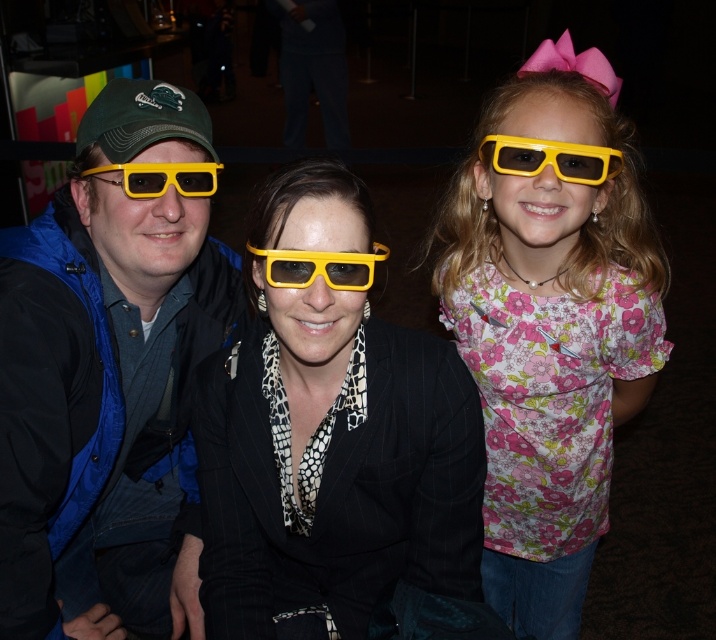
Question: Does floral fabric shirt at center come in front of yellow matte 3d glasses at left?

Choices:
 (A) no
 (B) yes

Answer: (B)

Question: Which of the following is the farthest from the observer?

Choices:
 (A) matte yellow plastic glasses at left
 (B) yellow matte plastic goggles at center
 (C) matte black suit at center
 (D) floral fabric shirt at center

Answer: (A)

Question: Does matte yellow plastic glasses at left appear on the left side of yellow matte plastic goggles at center?

Choices:
 (A) yes
 (B) no

Answer: (A)

Question: Is matte black suit at center thinner than floral fabric shirt at center?

Choices:
 (A) yes
 (B) no

Answer: (A)

Question: Which is farther from the yellow plastic goggles at upper right?

Choices:
 (A) matte yellow plastic glasses at left
 (B) yellow matte plastic goggles at center
 (C) matte black suit at center

Answer: (A)

Question: Which point is farther from the camera taking this photo?

Choices:
 (A) (120, 88)
 (B) (309, 282)
 (C) (579, 96)

Answer: (A)